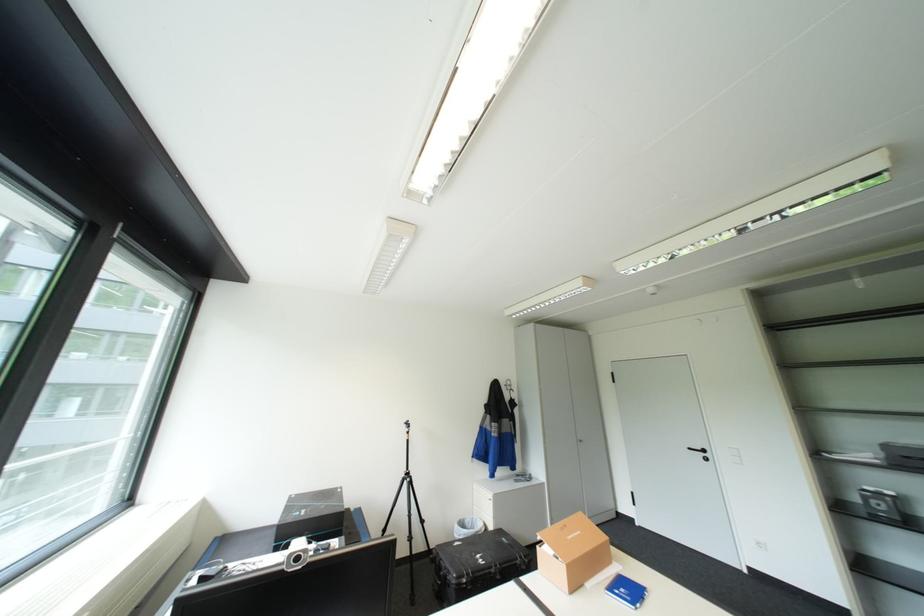
Describe the element at coordinates (704, 458) in the screenshot. The width and height of the screenshot is (924, 616). I see `the silver cabinet knob` at that location.